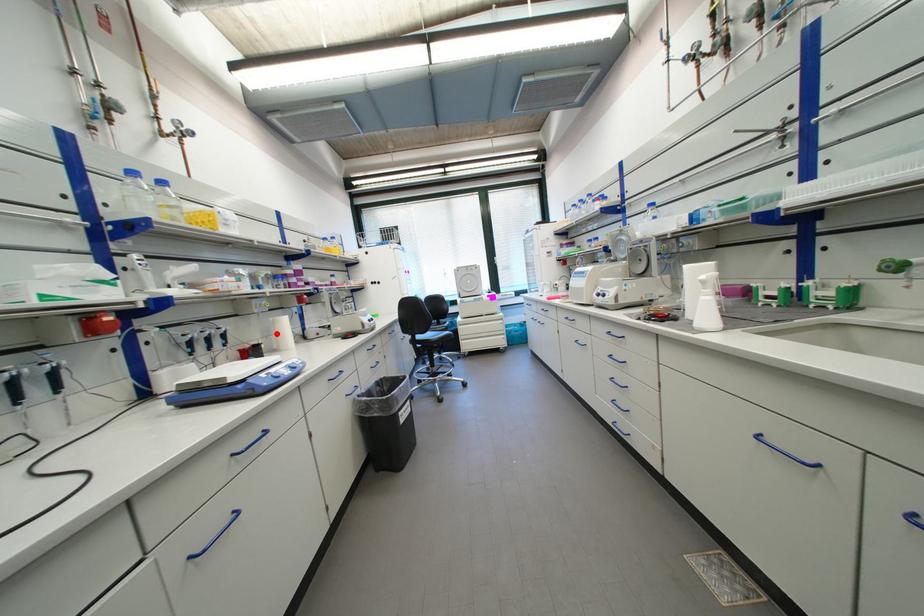
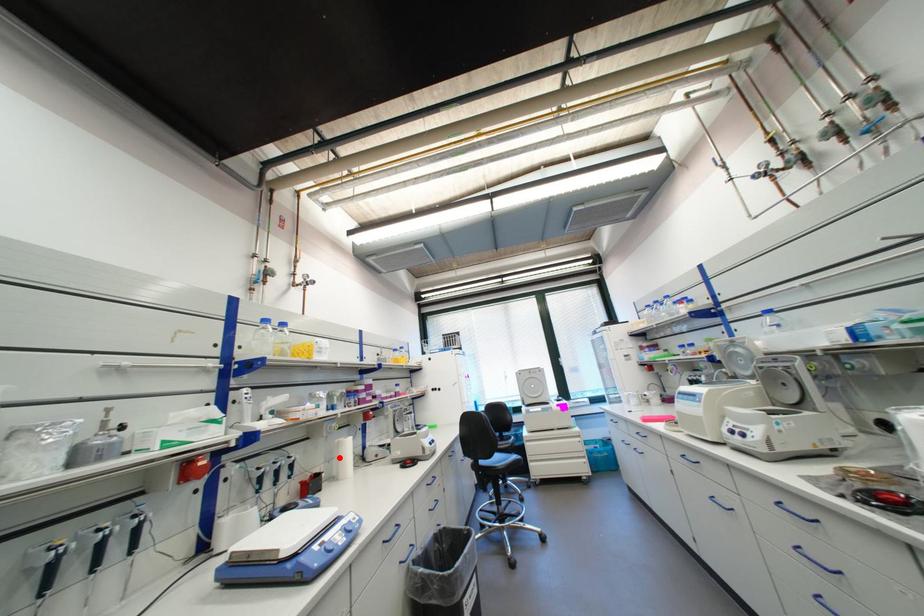
I am providing you with two images of the same scene from different viewpoints. A red point is marked on the first image and another point is marked on the second image. Are the points marked in image1 and image2 representing the same 3D position?

Yes